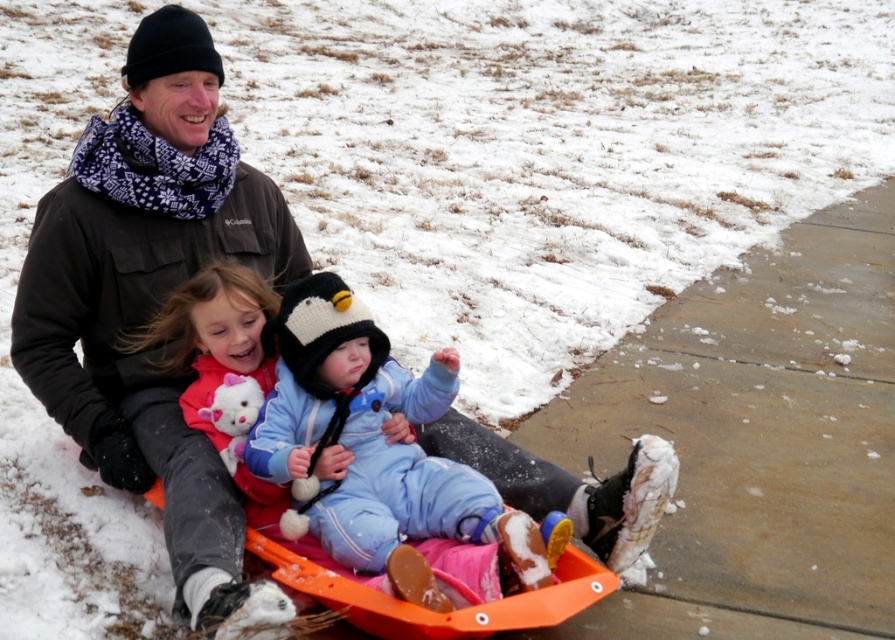
Looking at the two people in the sled, the dark brown jacket at center and the light blue fleece snowsuit at center, which one is positioned to the left?

The dark brown jacket at center is to the left of the light blue fleece snowsuit at center.

You are a photographer trying to capture a photo of the dark brown jacket at center and the light blue fleece snowsuit at center. Which one is closer to the camera?

The dark brown jacket at center is in front of the light blue fleece snowsuit at center, so it is closer to the camera.

In the winter scene, there are two people wearing a dark brown jacket at center and a light blue fleece snowsuit at center. Which one is taller?

The dark brown jacket at center is much taller than the light blue fleece snowsuit at center.